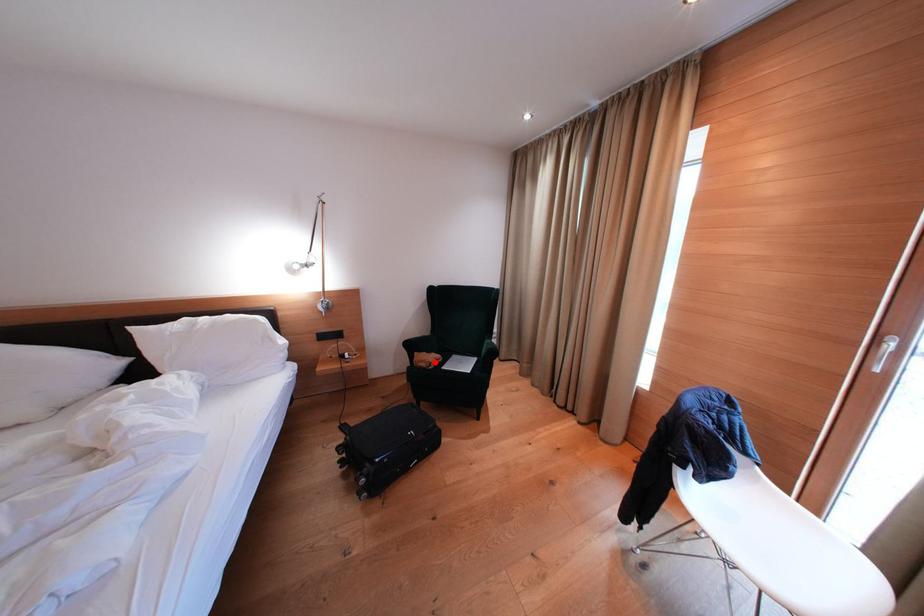
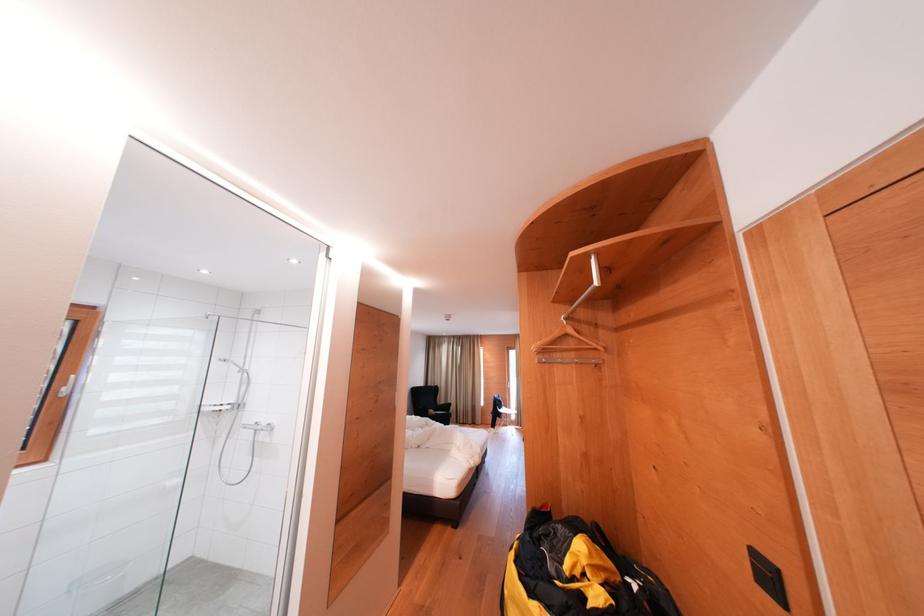
The point at the highlighted location is marked in the first image. Where is the corresponding point in the second image?

(439, 416)